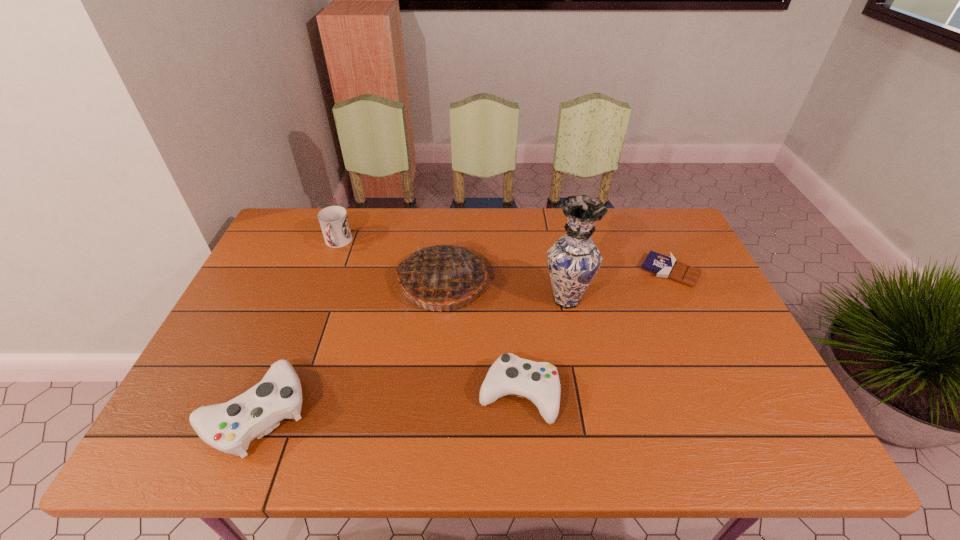
In order to click on free region located 0.180m on the right of the right control in this screenshot , I will do `click(636, 394)`.

You are a GUI agent. You are given a task and a screenshot of the screen. Output one action in this format:
    pyautogui.click(x=<x>, y=<y>)
    Task: Click on the blank space located on the side of the cup where the handle is located
    
    Given the screenshot: What is the action you would take?
    pyautogui.click(x=324, y=277)

The width and height of the screenshot is (960, 540). I want to click on vacant region located on the front of the second tallest object, so click(x=433, y=377).

Locate an element on the screen. free space located 0.100m on the left of the rightmost object is located at coordinates pyautogui.click(x=608, y=271).

The width and height of the screenshot is (960, 540). In order to click on free region located 0.060m on the back of the vase in this screenshot , I will do `click(561, 269)`.

Identify the location of object positioned at the far edge. This screenshot has height=540, width=960. (333, 220).

You are a GUI agent. You are given a task and a screenshot of the screen. Output one action in this format:
    pyautogui.click(x=<x>, y=<y>)
    Task: Click on the object at the left edge
    
    Given the screenshot: What is the action you would take?
    pyautogui.click(x=229, y=427)

This screenshot has height=540, width=960. In order to click on object that is positioned at the right edge in this screenshot , I will do `click(667, 267)`.

Find the location of `object present at the near left corner`. object present at the near left corner is located at coordinates (229, 427).

In the image, there is a desktop. Where is `vacant space at the far edge`? This screenshot has height=540, width=960. vacant space at the far edge is located at coordinates (479, 213).